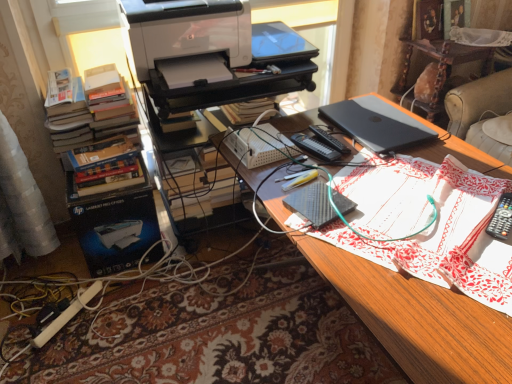
Where is `free space that is in between black matte laptop at upper right and black plastic remote control at right`? free space that is in between black matte laptop at upper right and black plastic remote control at right is located at coordinates (445, 180).